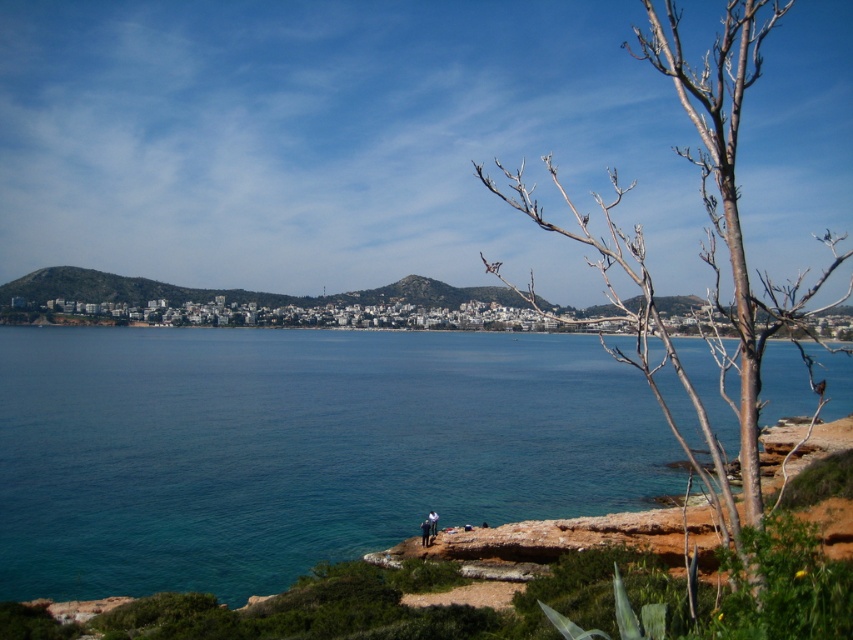
You are standing at the edge of the rocky shoreline in the coastal landscape. You see a point marked at coordinates (706, 237). What object does this point correspond to?

The point at coordinates (706, 237) corresponds to the bare wood tree at right.

You are standing on the rocky shoreline and want to estimate how far the blue water at center is from you. Based on the scene, what is the approximate distance?

The blue water at center is approximately 126.81 meters away from the camera, so the distance from you to the blue water at center is roughly 126.81 meters.